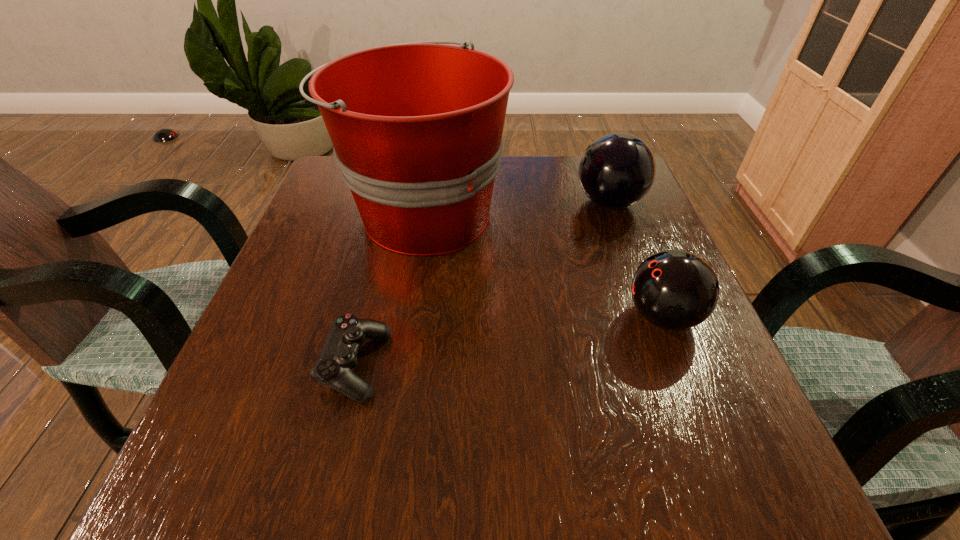
Where is `free space between the nearer bowling ball and the bucket`? The height and width of the screenshot is (540, 960). free space between the nearer bowling ball and the bucket is located at coordinates (543, 265).

The image size is (960, 540). Identify the location of vacant area that lies between the bucket and the nearer bowling ball. (543, 265).

The image size is (960, 540). I want to click on free spot between the nearer bowling ball and the tallest object, so click(x=543, y=265).

Image resolution: width=960 pixels, height=540 pixels. Find the location of `vacant point located between the nearer bowling ball and the shortest object`. vacant point located between the nearer bowling ball and the shortest object is located at coordinates (509, 341).

The image size is (960, 540). Identify the location of vacant space that's between the control and the shorter bowling ball. (509, 341).

Find the location of `free spot between the shorter bowling ball and the farther bowling ball`. free spot between the shorter bowling ball and the farther bowling ball is located at coordinates (636, 259).

What are the coordinates of `object that is the closest to the second tallest object` in the screenshot? It's located at (417, 127).

Locate which object is the third closest to the bucket. Please provide its 2D coordinates. Your answer should be formatted as a tuple, i.e. [(x, y)], where the tuple contains the x and y coordinates of a point satisfying the conditions above.

[(674, 289)]

The width and height of the screenshot is (960, 540). In order to click on free space in the image that satisfies the following two spatial constraints: 1. on the side of the taller bowling ball with the finger holes; 2. on the front side of the tallest object in this screenshot , I will do `click(613, 213)`.